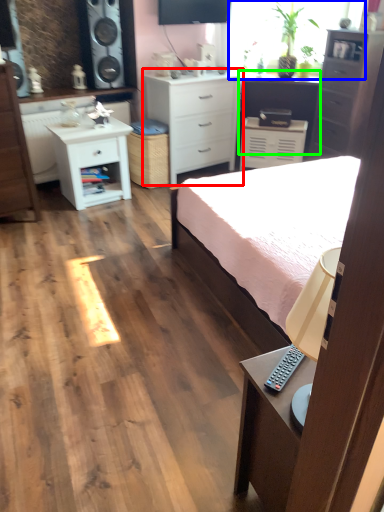
Question: Which object is positioned farthest from chest of drawers (highlighted by a red box)? Select from window screen (highlighted by a blue box) and vanity (highlighted by a green box).

Choices:
 (A) window screen
 (B) vanity

Answer: (A)